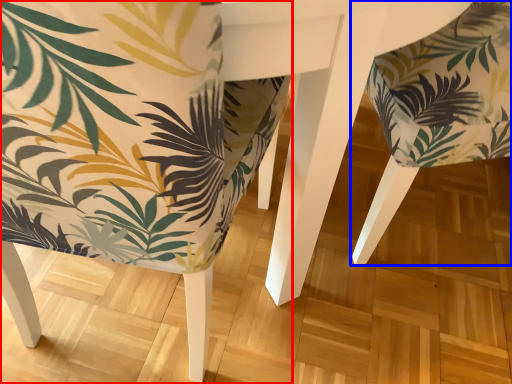
Question: Which object is closer to the camera taking this photo, chair (highlighted by a red box) or chair (highlighted by a blue box)?

Choices:
 (A) chair
 (B) chair

Answer: (A)